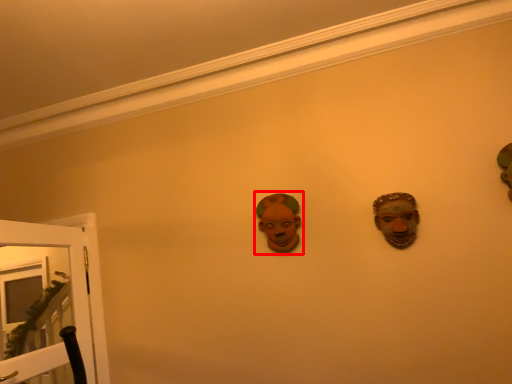
Question: From the image's perspective, where is person (annotated by the red box) located relative to door?

Choices:
 (A) below
 (B) above

Answer: (B)